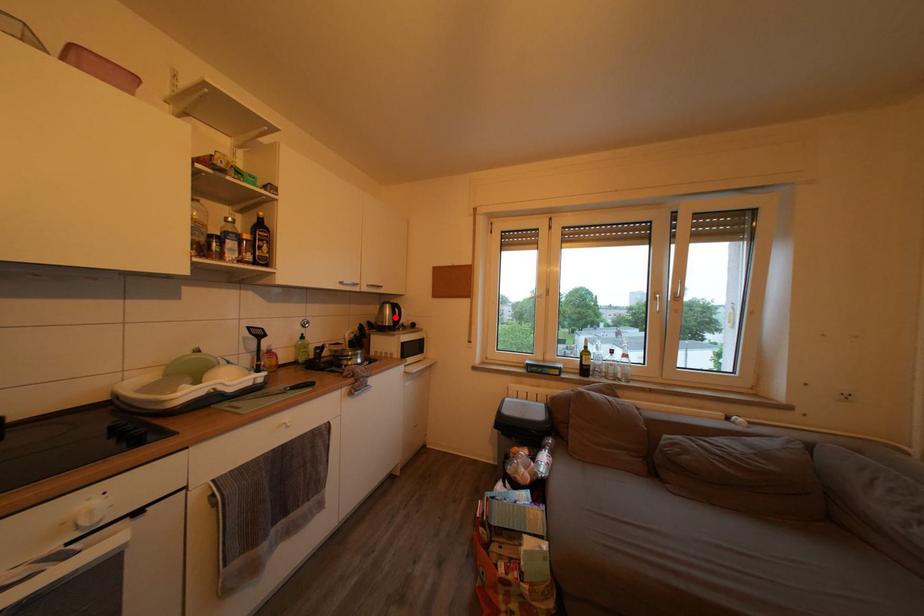
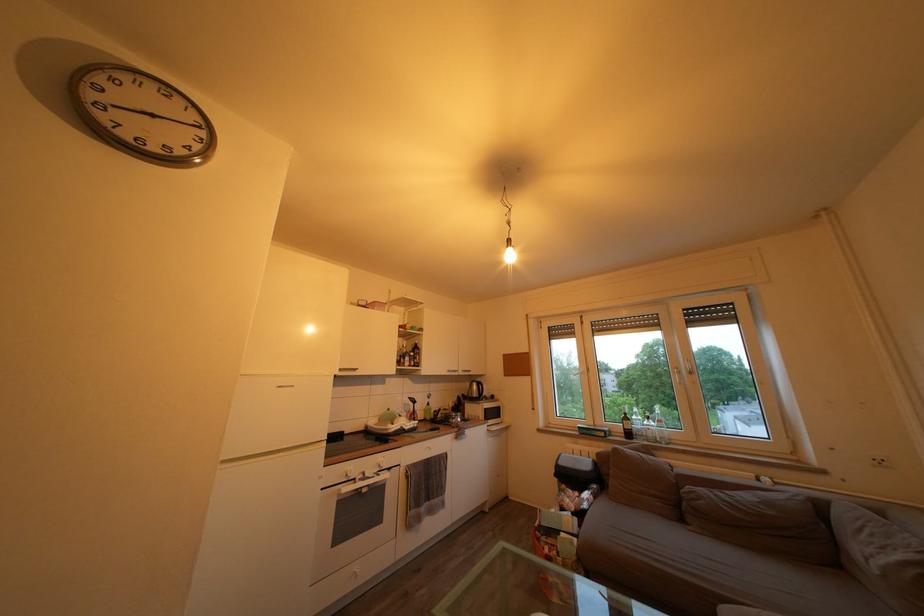
Locate, in the second image, the point that corresponds to the highlighted location in the first image.

(482, 392)